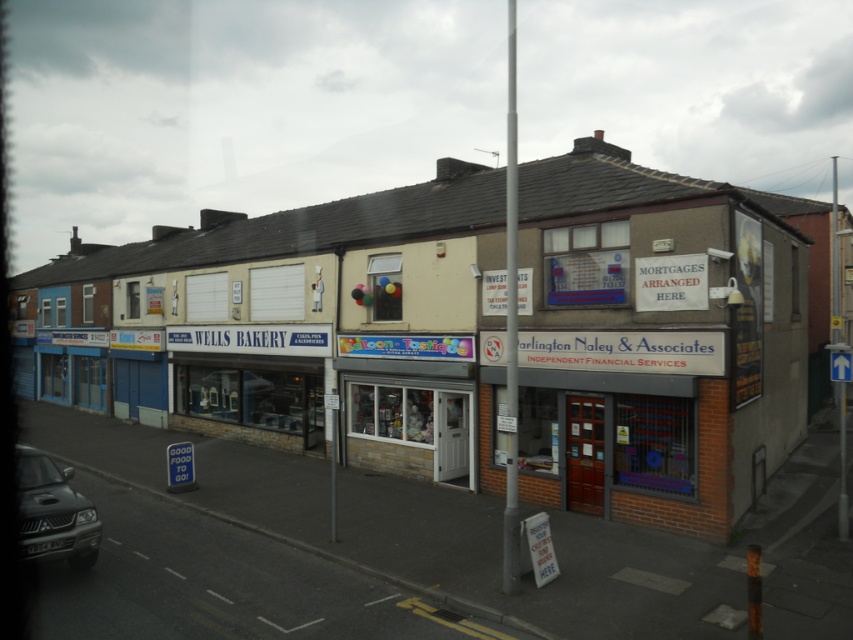
You are a delivery person needing to park your 2.5 meter wide van between the matte black car at lower left and the metallic pole at center. Can your van fit in the space between them?

The matte black car at lower left has a lesser width compared to the metallic pole at center. Since the car is narrower than the pole, the space between them might be sufficient for a 2.5 meter wide van, but it depends on the exact distance between the two objects. However, based on the width comparison alone, the pole is wider, so the space between them could accommodate the van.